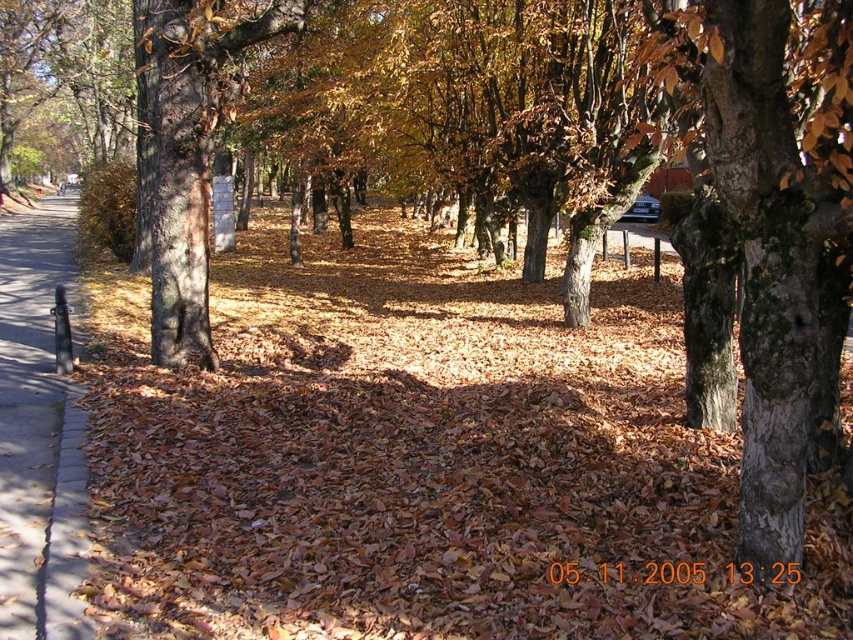
You are a gardener planning to place a new tree sapling in the garden. You need to ensure it has enough space to grow. Based on the scene, which object, the concrete sidewalk at left or the brown rough bark tree at left, has more space allocated to it?

The concrete sidewalk at left has a larger size compared to the brown rough bark tree at left, so the concrete sidewalk at left has more space allocated to it.